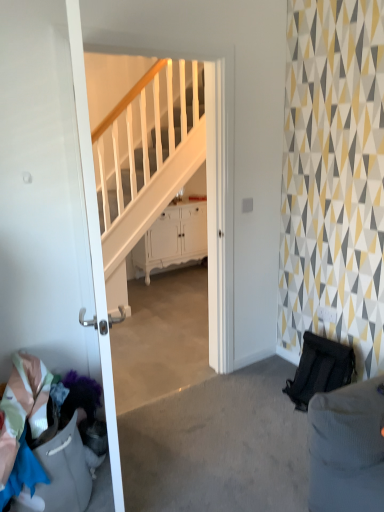
Question: Can you confirm if multicolored fabric at lower left is positioned to the right of white glossy door at left?

Choices:
 (A) no
 (B) yes

Answer: (A)

Question: Is multicolored fabric at lower left smaller than white glossy door at left?

Choices:
 (A) yes
 (B) no

Answer: (A)

Question: Can you confirm if multicolored fabric at lower left is taller than white glossy door at left?

Choices:
 (A) yes
 (B) no

Answer: (B)

Question: Does multicolored fabric at lower left appear on the left side of white glossy door at left?

Choices:
 (A) no
 (B) yes

Answer: (B)

Question: Is multicolored fabric at lower left wider than white glossy door at left?

Choices:
 (A) no
 (B) yes

Answer: (B)

Question: Based on their sizes in the image, would you say white glossy cabinet at center is bigger or smaller than white glossy door at left?

Choices:
 (A) small
 (B) big

Answer: (B)

Question: Considering the positions of point (168, 245) and point (24, 303), is point (168, 245) closer or farther from the camera than point (24, 303)?

Choices:
 (A) farther
 (B) closer

Answer: (A)

Question: Is white glossy cabinet at center to the left or to the right of white glossy door at left in the image?

Choices:
 (A) left
 (B) right

Answer: (B)

Question: From their relative heights in the image, would you say white glossy cabinet at center is taller or shorter than white glossy door at left?

Choices:
 (A) tall
 (B) short

Answer: (B)

Question: Considering their positions, is white glossy door at left located in front of or behind white glossy cabinet at center?

Choices:
 (A) behind
 (B) front

Answer: (B)

Question: Visually, is white glossy door at left positioned to the left or to the right of white glossy cabinet at center?

Choices:
 (A) left
 (B) right

Answer: (A)

Question: From a real-world perspective, is white glossy door at left above or below white glossy cabinet at center?

Choices:
 (A) below
 (B) above

Answer: (B)

Question: Is point (84, 228) positioned closer to the camera than point (168, 232)?

Choices:
 (A) closer
 (B) farther

Answer: (A)

Question: Which is correct: multicolored fabric at lower left is inside white glossy door at left, or outside of it?

Choices:
 (A) outside
 (B) inside

Answer: (A)

Question: In terms of height, does multicolored fabric at lower left look taller or shorter compared to white glossy door at left?

Choices:
 (A) tall
 (B) short

Answer: (B)